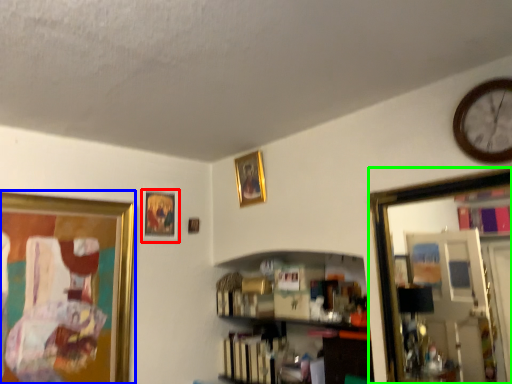
Question: Considering the real-world distances, which object is farthest from picture frame (highlighted by a red box)? picture frame (highlighted by a blue box) or mirror (highlighted by a green box)?

Choices:
 (A) picture frame
 (B) mirror

Answer: (B)